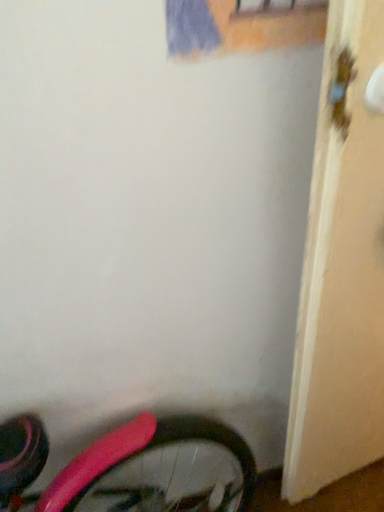
This screenshot has height=512, width=384. What are the coordinates of `wooden door at right` in the screenshot? It's located at (342, 270).

What do you see at coordinates (342, 270) in the screenshot? I see `wooden door at right` at bounding box center [342, 270].

You are a GUI agent. You are given a task and a screenshot of the screen. Output one action in this format:
    pyautogui.click(x=<x>, y=<y>)
    Task: Click on the wooden door at right
    
    Given the screenshot: What is the action you would take?
    pyautogui.click(x=342, y=270)